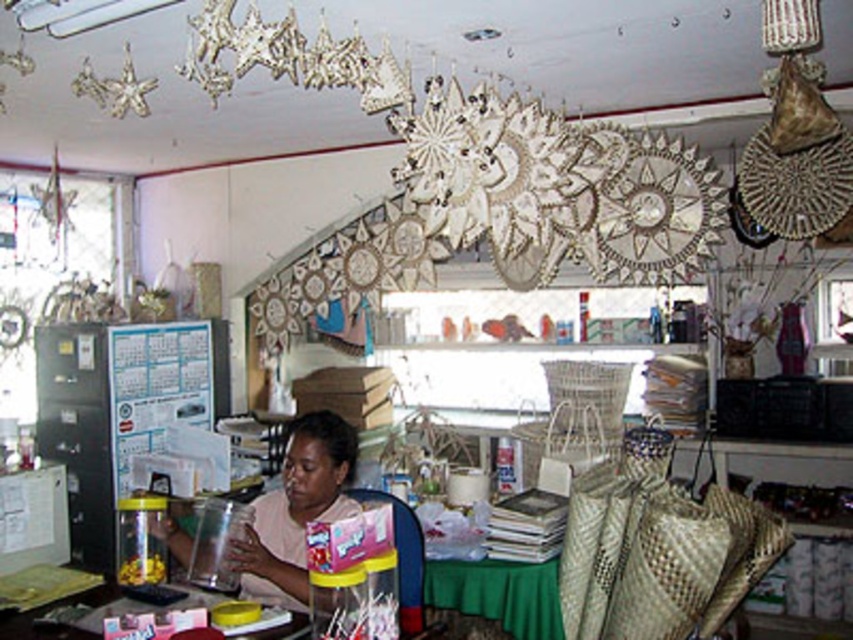
Question: Which point is closer to the camera taking this photo?

Choices:
 (A) (421, 600)
 (B) (245, 556)

Answer: (B)

Question: Is translucent plastic table at center bigger than plastic/glass chair at lower center?

Choices:
 (A) no
 (B) yes

Answer: (A)

Question: Estimate the real-world distances between objects in this image. Which object is closer to the translucent plastic table at center?

Choices:
 (A) plastic/glass chair at lower center
 (B) matte pink shirt at center

Answer: (B)

Question: Among these objects, which one is farthest from the camera?

Choices:
 (A) translucent plastic table at center
 (B) plastic/glass chair at lower center
 (C) matte pink shirt at center

Answer: (C)

Question: Is translucent plastic table at center positioned at the back of plastic/glass chair at lower center?

Choices:
 (A) no
 (B) yes

Answer: (A)

Question: Can you confirm if translucent plastic table at center is positioned below plastic/glass chair at lower center?

Choices:
 (A) no
 (B) yes

Answer: (B)